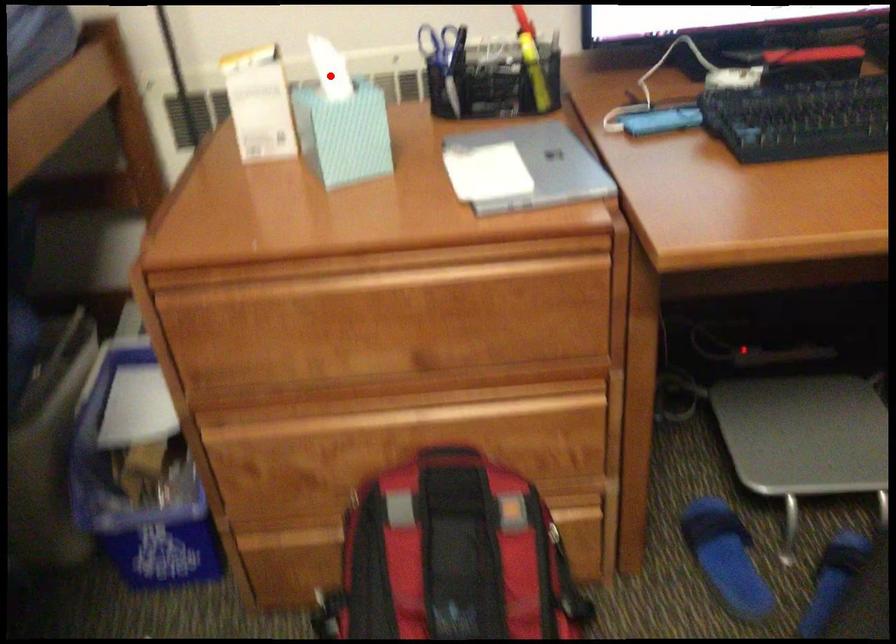
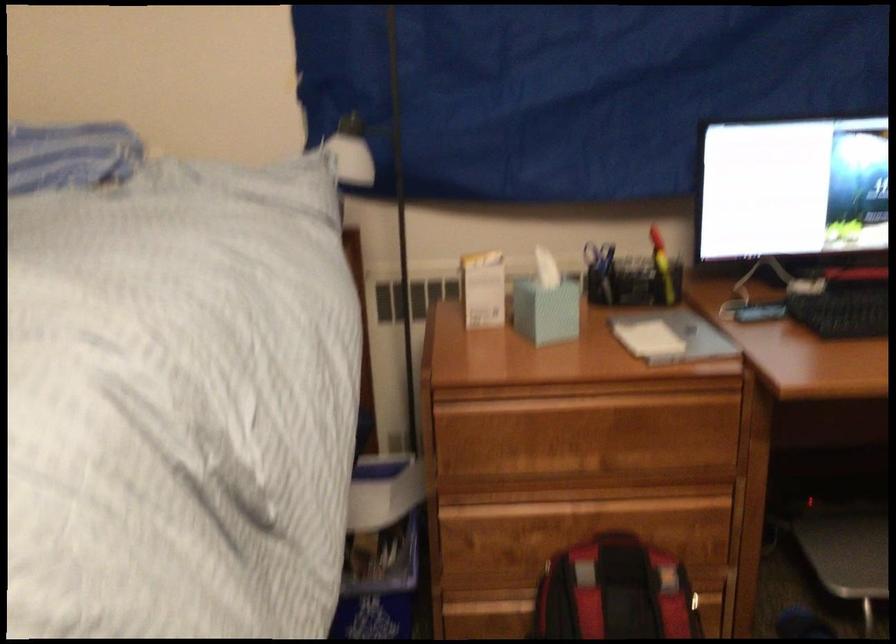
Question: I am providing you with two images of the same scene from different viewpoints. In image1, a red point is highlighted. Considering the same 3D point in image2, which of the following is correct?

Choices:
 (A) It is closer
 (B) It is farther

Answer: (B)